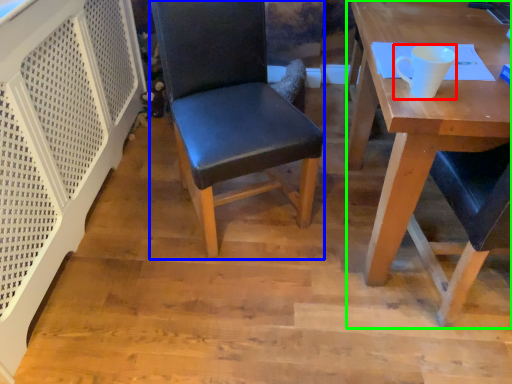
Question: Based on their relative distances, which object is farther from coffee cup (highlighted by a red box)? Choose from chair (highlighted by a blue box) and desk (highlighted by a green box).

Choices:
 (A) chair
 (B) desk

Answer: (A)